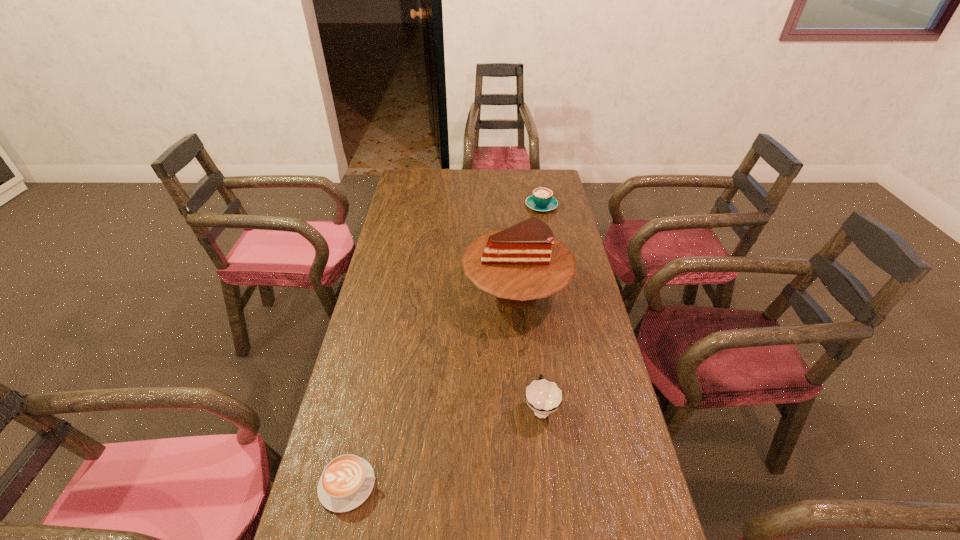
At what (x,y) coordinates should I click in order to perform the action: click on the third nearest object. Please return your answer as a coordinate pair (x, y). The height and width of the screenshot is (540, 960). Looking at the image, I should click on (525, 262).

Identify the location of the tallest object. The height and width of the screenshot is (540, 960). (525, 262).

Locate an element on the screen. cup is located at coordinates (544, 397).

Identify the location of the second nearest object. This screenshot has height=540, width=960. (544, 397).

Find the location of `the farther cappuccino`. the farther cappuccino is located at coordinates coord(542,199).

Where is `the right cappuccino`? This screenshot has height=540, width=960. the right cappuccino is located at coordinates pos(542,199).

This screenshot has height=540, width=960. I want to click on the nearest object, so click(346, 482).

Identify the location of the left cappuccino. The width and height of the screenshot is (960, 540). (346, 482).

Identify the location of vacant space located on the back of the tallest object. (509, 209).

The width and height of the screenshot is (960, 540). Identify the location of free point located on the side of the cup with the handle. (529, 305).